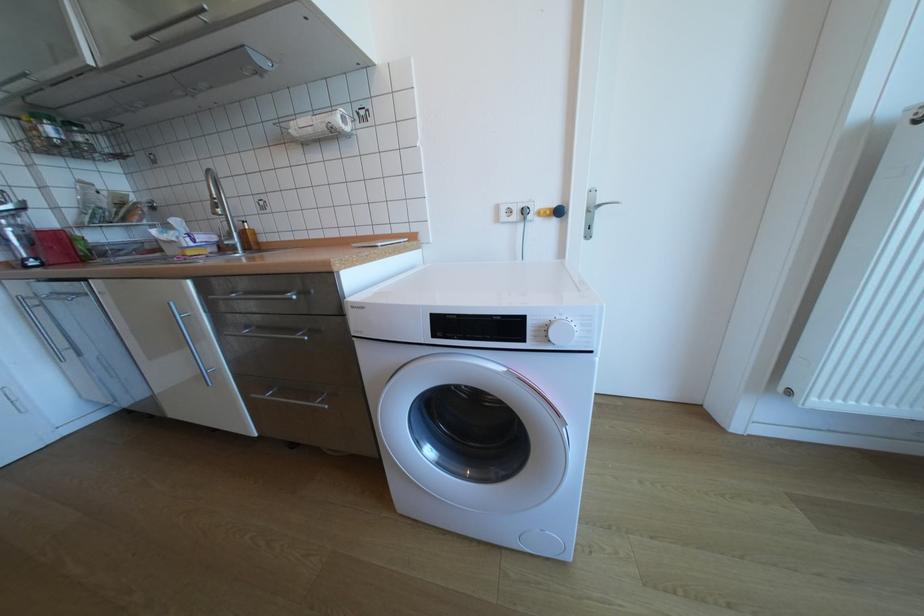
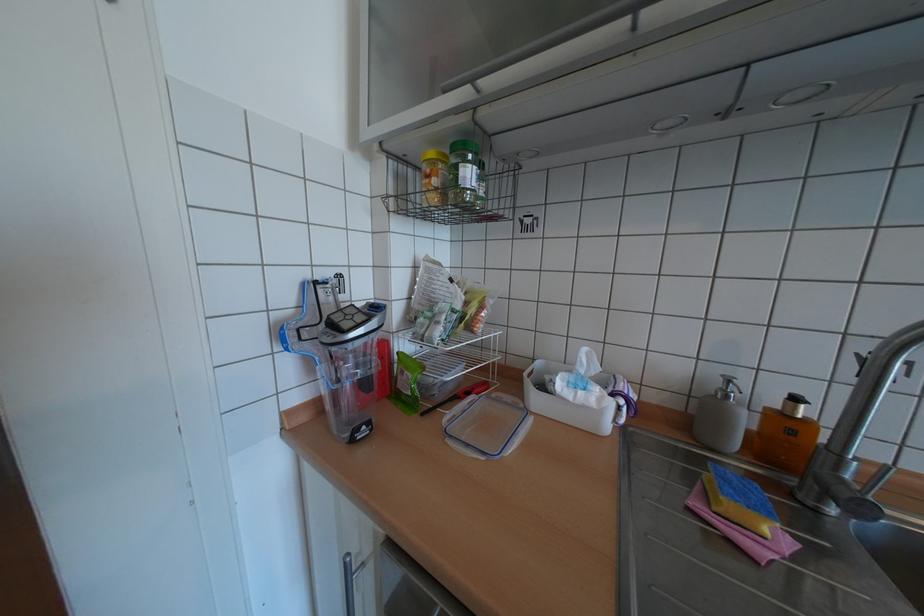
Which direction would the cameraman need to move to produce the second image?

The movement direction of the cameraman is left, forward.